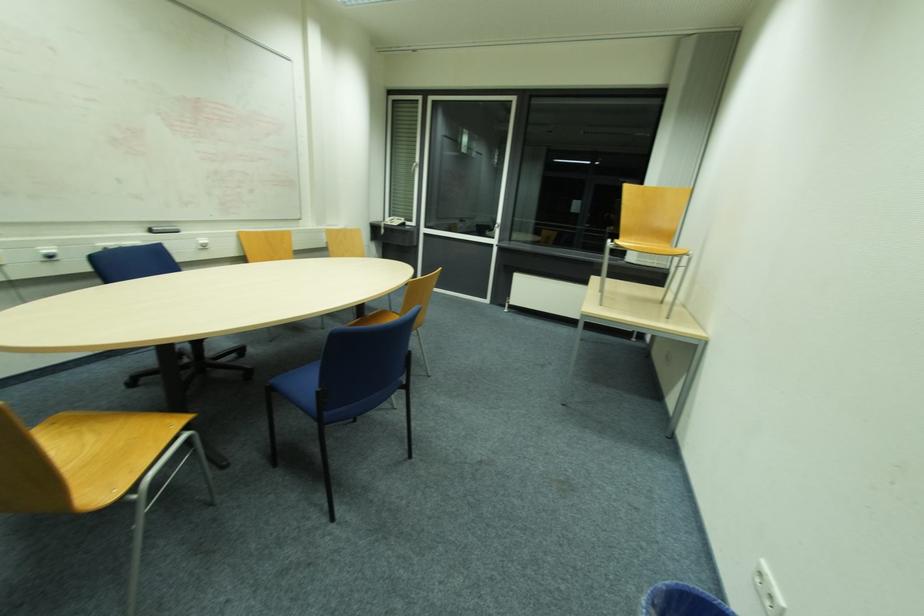
The height and width of the screenshot is (616, 924). Identify the location of door handle. (493, 231).